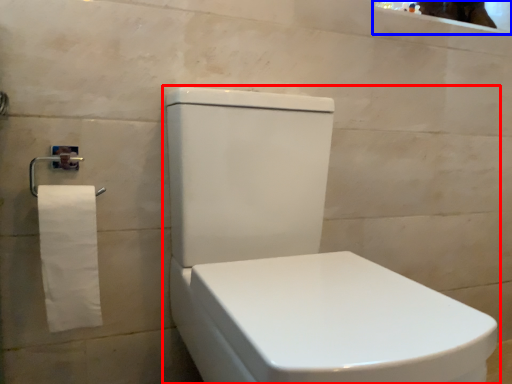
Question: Which point is closer to the camera, toilet (highlighted by a red box) or mirror (highlighted by a blue box)?

Choices:
 (A) toilet
 (B) mirror

Answer: (A)